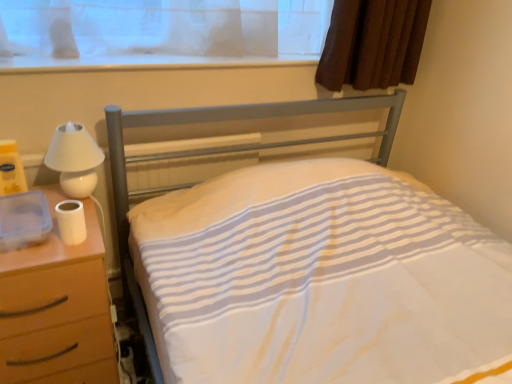
Question: In the image, is white matte toilet paper at left positioned in front of or behind white plastic window sill at upper center?

Choices:
 (A) front
 (B) behind

Answer: (A)

Question: In terms of width, does white matte toilet paper at left look wider or thinner when compared to white plastic window sill at upper center?

Choices:
 (A) wide
 (B) thin

Answer: (B)

Question: Based on their relative distances, which object is farther from the white striped fabric at center?

Choices:
 (A) white matte nightstand at left
 (B) white glossy lamp at left
 (C) white plastic window sill at upper center
 (D) white matte toilet paper at left

Answer: (D)

Question: Which object is the farthest from the white plastic window sill at upper center?

Choices:
 (A) white matte nightstand at left
 (B) white matte toilet paper at left
 (C) white glossy lamp at left
 (D) white striped fabric at center

Answer: (A)